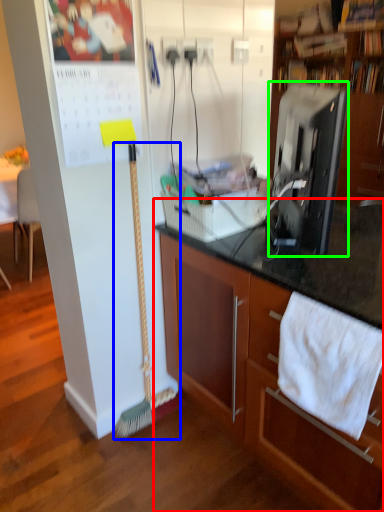
Question: Considering the real-world distances, which object is farthest from cabinetry (highlighted by a red box)? brush (highlighted by a blue box) or desktop computer (highlighted by a green box)?

Choices:
 (A) brush
 (B) desktop computer

Answer: (A)